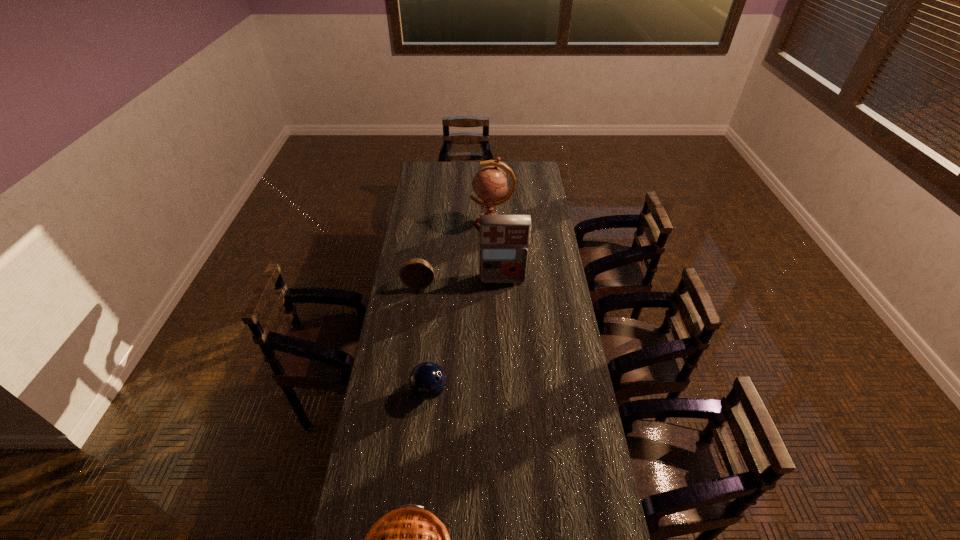
The image size is (960, 540). In order to click on free area in between the fourth shortest object and the third tallest object in this screenshot , I will do `click(461, 281)`.

Image resolution: width=960 pixels, height=540 pixels. In order to click on object that ranks as the second closest to the shortest object in this screenshot , I will do `click(416, 273)`.

Locate which object ranks third in proximity to the bowling ball. Please provide its 2D coordinates. Your answer should be formatted as a tuple, i.e. [(x, y)], where the tuple contains the x and y coordinates of a point satisfying the conditions above.

[(504, 239)]

Where is `free space that satisfies the following two spatial constraints: 1. on the front-facing side of the first-aid kit; 2. on the surface of the second nearest object near the finger holes`? This screenshot has width=960, height=540. free space that satisfies the following two spatial constraints: 1. on the front-facing side of the first-aid kit; 2. on the surface of the second nearest object near the finger holes is located at coordinates (509, 391).